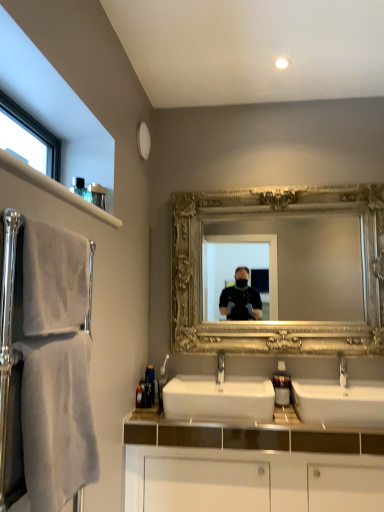
Identify the location of vacant space in front of translucent plastic bottle at lower left, acting as the 1th toiletry starting from the back. The width and height of the screenshot is (384, 512). 147,412.